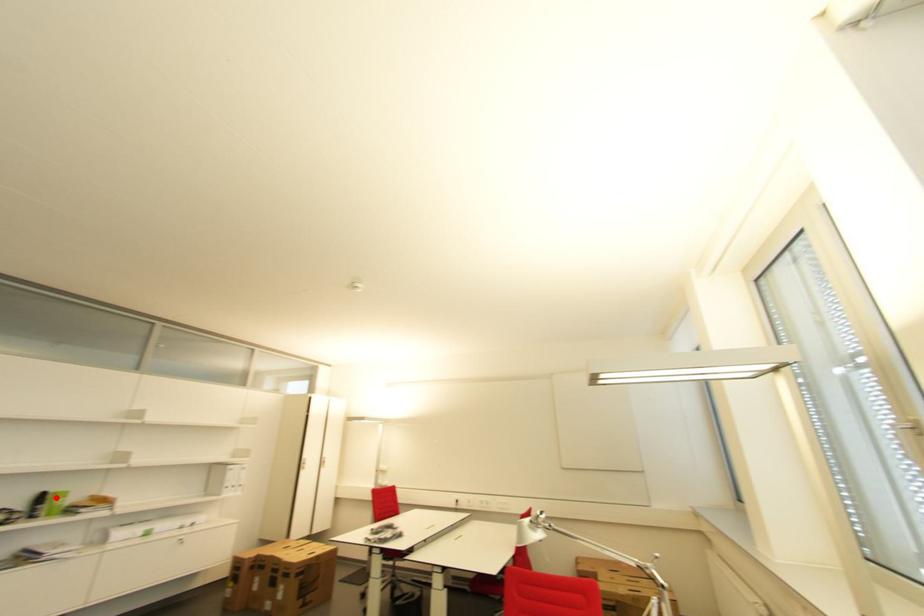
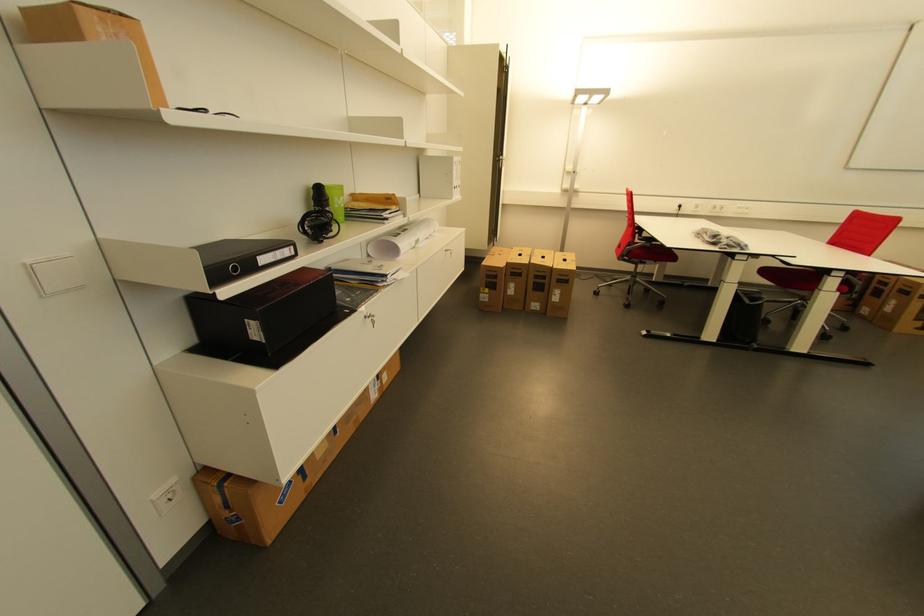
The point at the highlighted location is marked in the first image. Where is the corresponding point in the second image?

(333, 193)